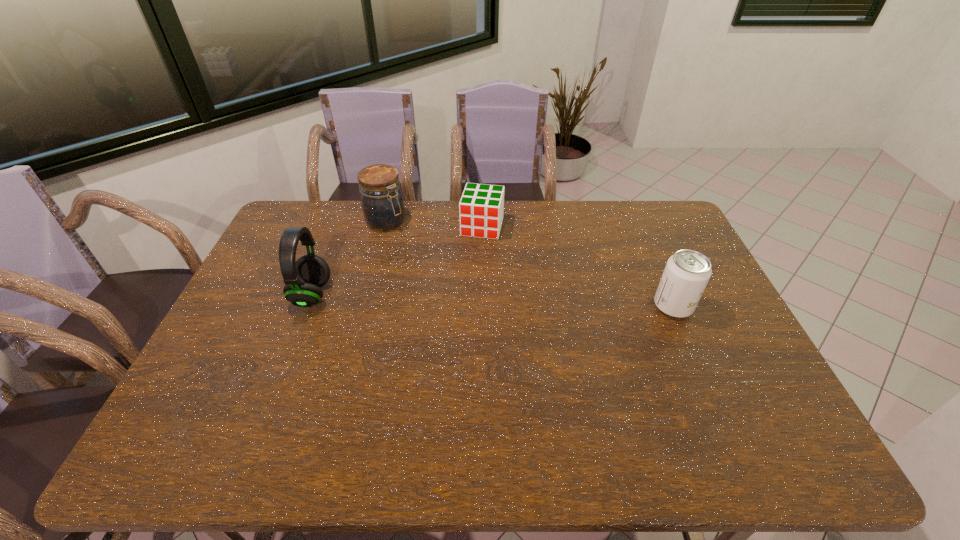
The image size is (960, 540). I want to click on headset, so click(x=303, y=278).

Identify the location of soda can. The image size is (960, 540). (687, 272).

Find the location of a particular element. the third tallest object is located at coordinates (687, 272).

The height and width of the screenshot is (540, 960). I want to click on the second object from left to right, so click(382, 202).

Where is `the second object from right to left`? The height and width of the screenshot is (540, 960). the second object from right to left is located at coordinates (481, 207).

Where is `the shortest object`? the shortest object is located at coordinates (x=481, y=207).

Where is `blank area located 0.190m on the ear cups of the headset`? Image resolution: width=960 pixels, height=540 pixels. blank area located 0.190m on the ear cups of the headset is located at coordinates (392, 294).

The width and height of the screenshot is (960, 540). Identify the location of vacant point located 0.230m on the left of the third tallest object. (576, 306).

The width and height of the screenshot is (960, 540). What are the coordinates of `vacant space located 0.370m on the lid of the jar` in the screenshot? It's located at (467, 281).

The image size is (960, 540). In order to click on vacant region located on the lid of the jar in this screenshot , I will do `click(411, 240)`.